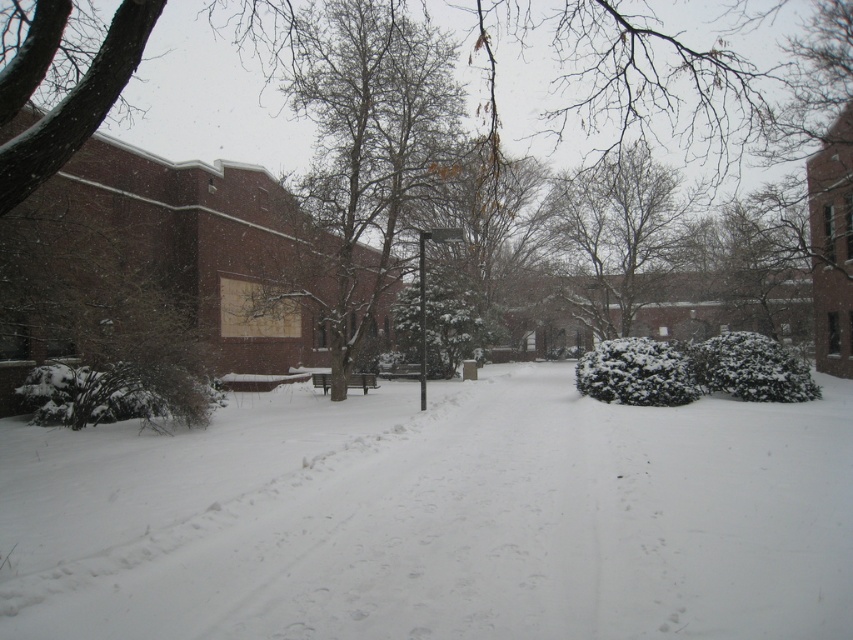
You are standing on the snow covered path in the winter scene. You see two points marked as point 1 at coordinates (570, 586) and point 2 at coordinates (444, 173). Which point is closer to you?

Point 1 at coordinates (570, 586) is closer to you than point 2 at coordinates (444, 173).